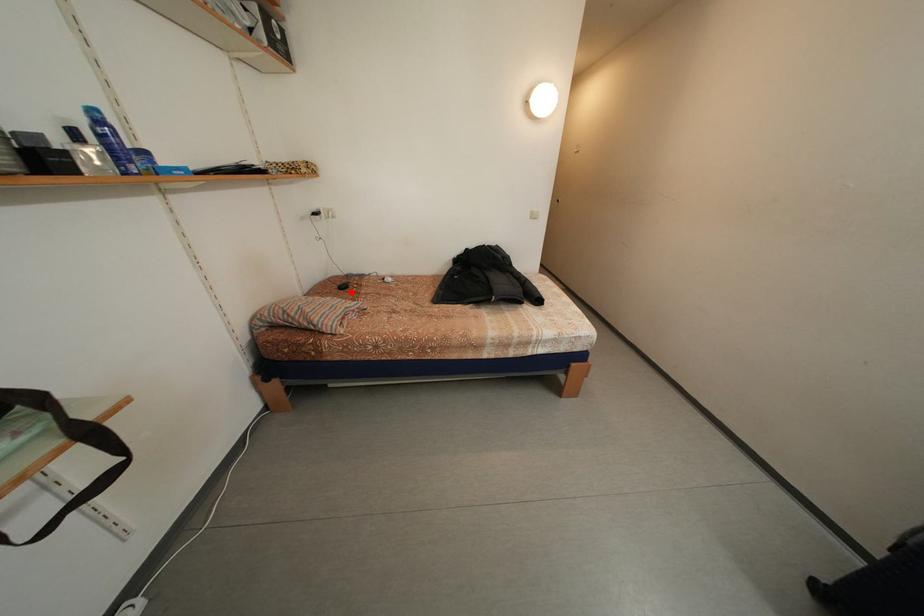
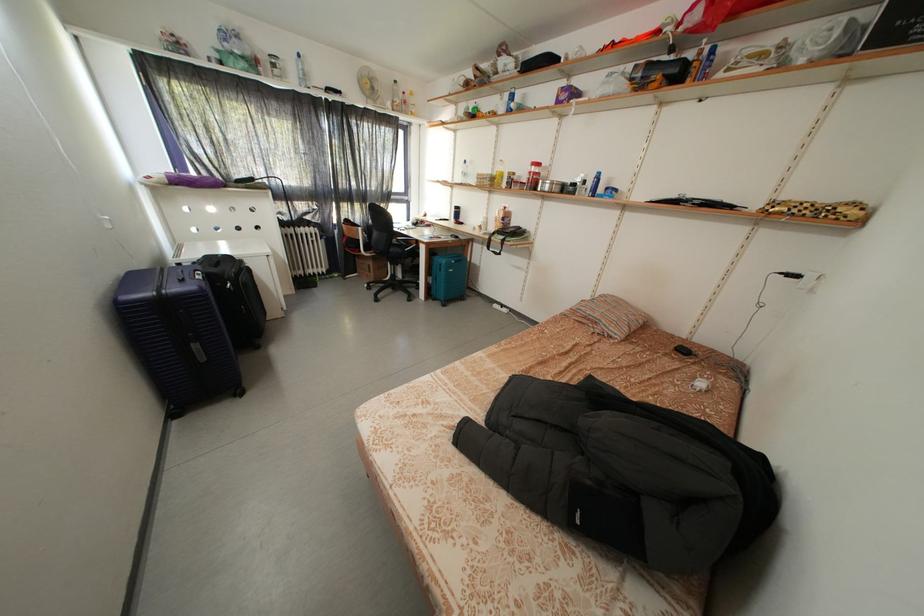
The point at the highlighted location is marked in the first image. Where is the corresponding point in the second image?

(691, 355)